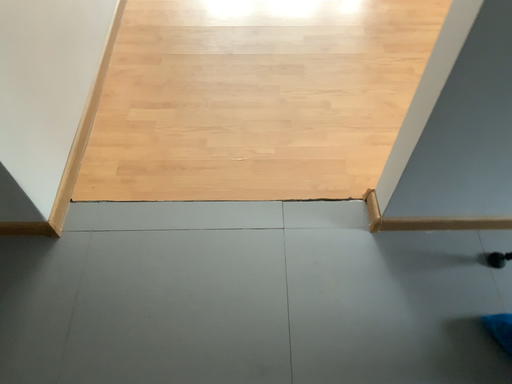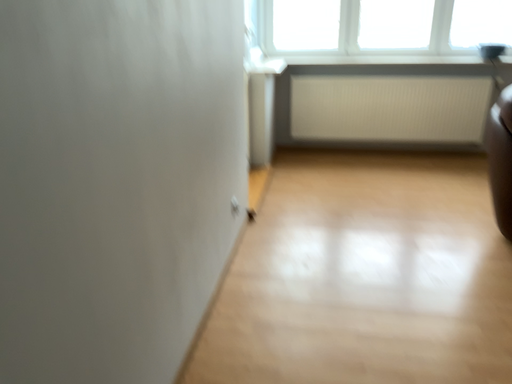
Question: How did the camera likely rotate when shooting the video?

Choices:
 (A) rotated upward
 (B) rotated downward

Answer: (A)